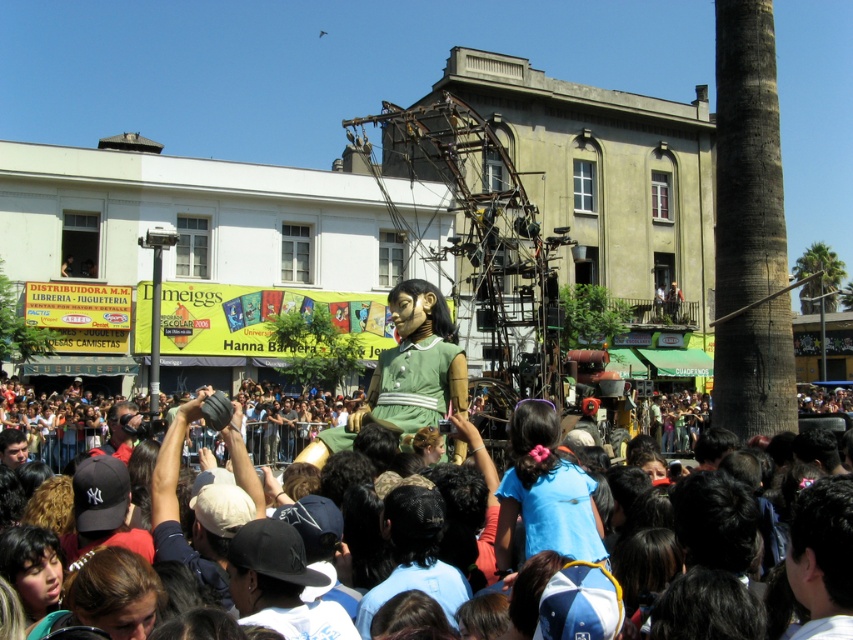
You are a photographer trying to capture the green fabric crowd at center and the matte black camera at lower left in a single frame. Which object should you focus on first if you want to ensure both are in focus, considering their sizes?

The green fabric crowd at center has a larger size compared to matte black camera at lower left, so you should focus on the larger object first to ensure both are in focus.

You are a photographer positioned at the edge of the scene. You want to capture a closeup shot of the green fabric crowd at center without moving closer than 25 meters. Is this possible?

The green fabric crowd at center is 30.76 meters away from the viewer. Since you cannot move closer than 25 meters, you cannot capture a closeup shot from your current position.

You are a photographer trying to capture a clear shot of the green fabric crowd at center. Based on their position, would you need to adjust your camera angle upward or downward to focus on them?

The green fabric crowd at center is located at point (770, 490), which is relatively high up in the frame. To focus on them, you would need to adjust your camera angle upward.